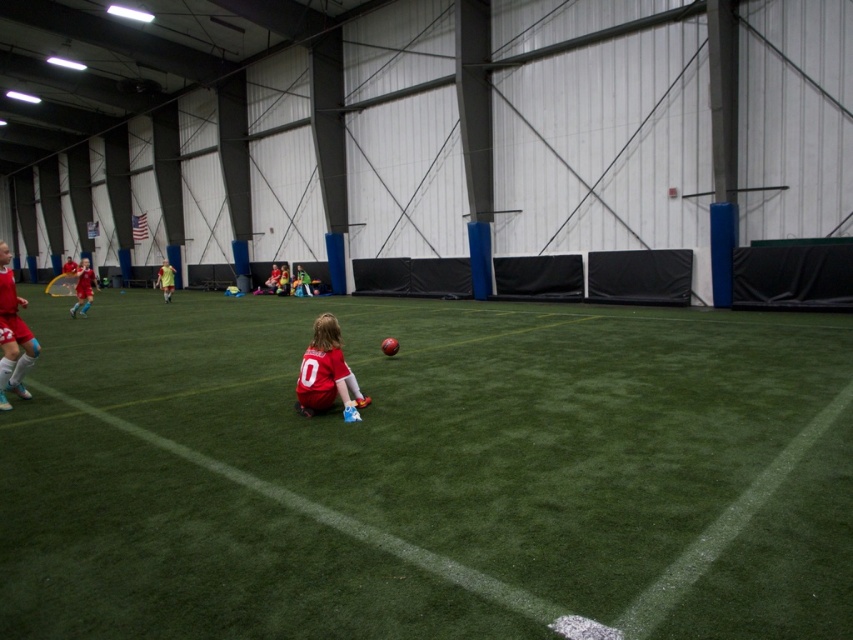
Question: Which point is closer to the camera taking this photo?

Choices:
 (A) (86, 285)
 (B) (544, 305)
 (C) (164, 259)
 (D) (328, 355)

Answer: (D)

Question: Is green artificial turf at center wider than yellow jersey at center?

Choices:
 (A) no
 (B) yes

Answer: (B)

Question: Can you confirm if green artificial turf at center is positioned below matte red jersey at center?

Choices:
 (A) yes
 (B) no

Answer: (A)

Question: Among these points, which one is nearest to the camera?

Choices:
 (A) (322, 349)
 (B) (80, 280)
 (C) (123, 589)

Answer: (C)

Question: Is matte red soccer jersey at upper left wider than yellow jersey at center?

Choices:
 (A) yes
 (B) no

Answer: (A)

Question: Which object appears closest to the camera in this image?

Choices:
 (A) green artificial turf at center
 (B) matte red jersey at center

Answer: (A)